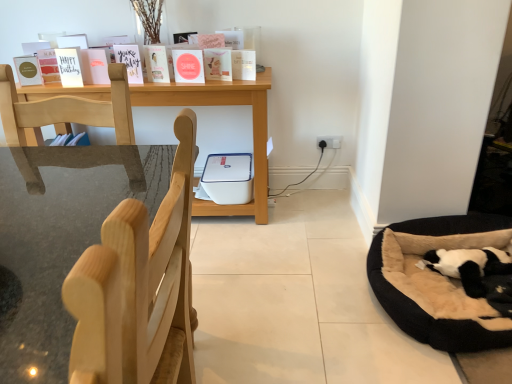
Identify the location of matte green paperback book at left, marked as the eighth paperback book in a right-to-left arrangement. (28, 70).

I want to click on black plush dog bed at lower right, so click(x=437, y=282).

Image resolution: width=512 pixels, height=384 pixels. Find the location of `matte white paperback book at center, positioned as the fifth paperback book in left-to-right order`. matte white paperback book at center, positioned as the fifth paperback book in left-to-right order is located at coordinates (158, 63).

Locate an element on the screen. This screenshot has height=384, width=512. matte white card at center, acting as the 5th paperback book starting from the right is located at coordinates (130, 61).

Is point (238, 79) in front of point (487, 264)?

No.

From a real-world perspective, relative to black plush dog bed at lower right, is white matte paperback book at upper center, positioned as the 8th paperback book in left-to-right order, vertically above or below?

Clearly, from a real-world perspective, white matte paperback book at upper center, positioned as the 8th paperback book in left-to-right order, is above black plush dog bed at lower right.

Which object is closer to the camera, white matte paperback book at upper center, positioned as the 8th paperback book in left-to-right order, or black plush dog bed at lower right?

black plush dog bed at lower right is in front.

Can you confirm if matte green paperback book at left, marked as the eighth paperback book in a right-to-left arrangement, is wider than black plush dog bed at lower right?

Incorrect, the width of matte green paperback book at left, marked as the eighth paperback book in a right-to-left arrangement, does not surpass that of black plush dog bed at lower right.

Choose the correct answer: Is matte green paperback book at left, marked as the eighth paperback book in a right-to-left arrangement, inside black plush dog bed at lower right or outside it?

matte green paperback book at left, marked as the eighth paperback book in a right-to-left arrangement, is outside black plush dog bed at lower right.

Measure the distance between matte green paperback book at left, marked as the eighth paperback book in a right-to-left arrangement, and black plush dog bed at lower right.

matte green paperback book at left, marked as the eighth paperback book in a right-to-left arrangement, is 2.11 meters from black plush dog bed at lower right.

Considering the positions of objects matte green paperback book at left, the 1th paperback book viewed from the left, and black plush dog bed at lower right in the image provided, who is more to the right, matte green paperback book at left, the 1th paperback book viewed from the left, or black plush dog bed at lower right?

From the viewer's perspective, black plush dog bed at lower right appears more on the right side.

In the scene shown: Considering their positions, is matte white paperback book at center, which ranks as the 2th paperback book in right-to-left order, located in front of or behind matte white greeting cards at upper left?

Clearly, matte white paperback book at center, which ranks as the 2th paperback book in right-to-left order, is behind matte white greeting cards at upper left.

Between matte white paperback book at center, which ranks as the seventh paperback book in left-to-right order, and matte white greeting cards at upper left, which one has more height?

Standing taller between the two is matte white greeting cards at upper left.

From the image's perspective, is matte white paperback book at center, which ranks as the seventh paperback book in left-to-right order, located beneath matte white greeting cards at upper left?

Indeed, from the image's perspective, matte white paperback book at center, which ranks as the seventh paperback book in left-to-right order, is shown beneath matte white greeting cards at upper left.

Looking at this image, is matte white paperback book at center, which ranks as the 2th paperback book in right-to-left order, not inside matte white greeting cards at upper left?

Yes.

From a real-world perspective, is matte white greeting cards at upper left beneath matte white paperback book at center, which ranks as the seventh paperback book in left-to-right order?

No, from a real-world perspective, matte white greeting cards at upper left is not beneath matte white paperback book at center, which ranks as the seventh paperback book in left-to-right order.

Considering the positions of points (246, 71) and (227, 77), is point (246, 71) farther from camera compared to point (227, 77)?

That is False.

Locate an element on the screen. magazine that is above the matte white paperback book at center, which ranks as the 2th paperback book in right-to-left order (from the image's perspective) is located at coordinates (238, 66).

Is matte white card at center, arranged as the fourth paperback book when viewed from the left, far away from matte green paperback book at left, the 1th paperback book viewed from the left?

matte white card at center, arranged as the fourth paperback book when viewed from the left, is actually quite close to matte green paperback book at left, the 1th paperback book viewed from the left.

From the image's perspective, which is below, matte white card at center, acting as the 5th paperback book starting from the right, or matte green paperback book at left, marked as the eighth paperback book in a right-to-left arrangement?

matte green paperback book at left, marked as the eighth paperback book in a right-to-left arrangement.

What's the angular difference between matte white card at center, acting as the 5th paperback book starting from the right, and matte green paperback book at left, the 1th paperback book viewed from the left,'s facing directions?

The facing directions of matte white card at center, acting as the 5th paperback book starting from the right, and matte green paperback book at left, the 1th paperback book viewed from the left, are 24.9 degrees apart.

From a real-world perspective, is black plush dog bed at lower right positioned above or below matte white card at center, arranged as the fourth paperback book when viewed from the left?

Clearly, from a real-world perspective, black plush dog bed at lower right is below matte white card at center, arranged as the fourth paperback book when viewed from the left.

Can you tell me how much black plush dog bed at lower right and matte white card at center, acting as the 5th paperback book starting from the right, differ in facing direction?

black plush dog bed at lower right and matte white card at center, acting as the 5th paperback book starting from the right, are facing 5.98 degrees away from each other.

Could you tell me if black plush dog bed at lower right is facing matte white card at center, arranged as the fourth paperback book when viewed from the left?

No, black plush dog bed at lower right is not facing towards matte white card at center, arranged as the fourth paperback book when viewed from the left.

Between black plush dog bed at lower right and matte white card at center, acting as the 5th paperback book starting from the right, which one has smaller width?

With smaller width is matte white card at center, acting as the 5th paperback book starting from the right.

Is matte pink card at center, the third paperback book from the right, wider or thinner than white matte card at upper left, the second paperback book viewed from the left?

In the image, matte pink card at center, the third paperback book from the right, appears to be wider than white matte card at upper left, the second paperback book viewed from the left.

Which of these two, matte pink card at center, the 6th paperback book when ordered from left to right, or white matte card at upper left, the second paperback book viewed from the left, stands taller?

Standing taller between the two is white matte card at upper left, the second paperback book viewed from the left.

From the image's perspective, is matte pink card at center, the third paperback book from the right, positioned above or below white matte card at upper left, the second paperback book viewed from the left?

Based on their image positions, matte pink card at center, the third paperback book from the right, is located above white matte card at upper left, the second paperback book viewed from the left.

You are a GUI agent. You are given a task and a screenshot of the screen. Output one action in this format:
    pyautogui.click(x=<x>, y=<y>)
    Task: Click on the animal located below the white matte paperback book at upper center, the 1th paperback book viewed from the right (from the image's perspective)
    Image resolution: width=512 pixels, height=384 pixels.
    Given the screenshot: What is the action you would take?
    pyautogui.click(x=469, y=266)

The width and height of the screenshot is (512, 384). I want to click on the 1st paperback book above the black plush dog bed at lower right (from the image's perspective), so click(x=28, y=70).

When comparing their distances from black plush dog bed at lower right, does white matte paperback book at upper center, positioned as the 8th paperback book in left-to-right order, or matte pink card at center, the third paperback book from the right, seem closer?

Among the two, white matte paperback book at upper center, positioned as the 8th paperback book in left-to-right order, is located nearer to black plush dog bed at lower right.

Looking at this image, considering their positions, is matte green paperback book at left, marked as the eighth paperback book in a right-to-left arrangement, positioned closer to matte white greeting cards at upper left than matte white paperback book at center, which appears as the 4th paperback book when viewed from the right?

Based on the image, matte white paperback book at center, which appears as the 4th paperback book when viewed from the right, appears to be nearer to matte white greeting cards at upper left.

Considering their positions, is matte green paperback book at left, the 1th paperback book viewed from the left, positioned further to matte white paperback book at center, which appears as the 4th paperback book when viewed from the right, than wooden table at center?

Among the two, matte green paperback book at left, the 1th paperback book viewed from the left, is located further to matte white paperback book at center, which appears as the 4th paperback book when viewed from the right.

Estimate the real-world distances between objects in this image. Which object is further from white matte card at upper left, which is the 7th paperback book from right to left, matte white paperback book at center, which ranks as the seventh paperback book in left-to-right order, or matte white greeting cards at upper left?

Based on the image, matte white paperback book at center, which ranks as the seventh paperback book in left-to-right order, appears to be further to white matte card at upper left, which is the 7th paperback book from right to left.

Consider the image. Which object lies further to the anchor point wooden table at center, black plush dog bed at lower right or matte white card at center, acting as the 5th paperback book starting from the right?

The object further to wooden table at center is black plush dog bed at lower right.

Estimate the real-world distances between objects in this image. Which object is closer to wooden table at center, light wood chair at left or matte white paperback book at center, positioned as the fifth paperback book in left-to-right order?

Among the two, matte white paperback book at center, positioned as the fifth paperback book in left-to-right order, is located nearer to wooden table at center.

From the image, which object appears to be nearer to matte white greeting cards at upper left, matte green paperback book at left, the 1th paperback book viewed from the left, or matte pink card at center, the third paperback book from the right?

matte pink card at center, the third paperback book from the right.

Based on their spatial positions, is matte pink card at center, the third paperback book from the right, or light wood chair at left closer to white matte card at upper left, the second paperback book viewed from the left?

Based on the image, matte pink card at center, the third paperback book from the right, appears to be nearer to white matte card at upper left, the second paperback book viewed from the left.

Find the location of a particular element. paperback book between matte pink card at center, the 6th paperback book when ordered from left to right, and white matte paperback book at upper center, the 1th paperback book viewed from the right, in the horizontal direction is located at coordinates (218, 64).

I want to click on magazine between matte white card at center, arranged as the fourth paperback book when viewed from the left, and white matte paperback book at upper center, positioned as the 8th paperback book in left-to-right order, so click(238, 66).

Identify the location of magazine situated between matte green paperback book at left, marked as the eighth paperback book in a right-to-left arrangement, and black plush dog bed at lower right from left to right. (238, 66).

Locate an element on the screen. Image resolution: width=512 pixels, height=384 pixels. chair between matte pink card at upper left, marked as the 3th paperback book in a left-to-right arrangement, and black plush dog bed at lower right from left to right is located at coordinates (138, 286).